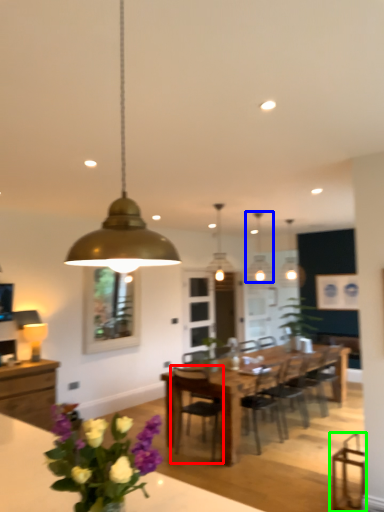
Question: Which is farther away from chair (highlighted by a red box)? lamp (highlighted by a blue box) or swivel chair (highlighted by a green box)?

Choices:
 (A) lamp
 (B) swivel chair

Answer: (A)